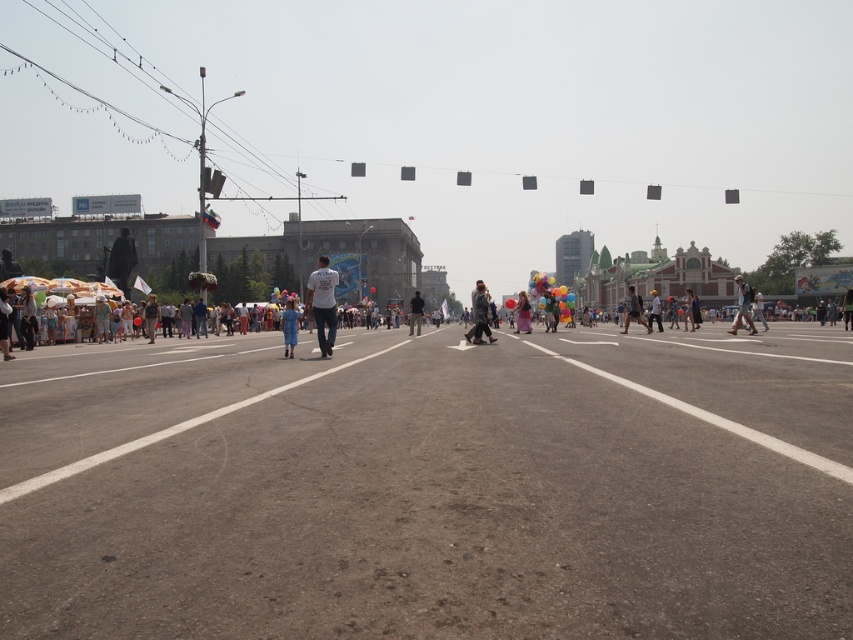
Where is `matte gray coat at center`? This screenshot has height=640, width=853. matte gray coat at center is located at coordinates (479, 316).

Is point (477, 339) closer to camera compared to point (746, 288)?

That is True.

Who is more forward, (467, 339) or (744, 291)?

Point (467, 339) is in front.

This screenshot has height=640, width=853. I want to click on matte gray coat at center, so click(479, 316).

Does dark blue jeans at center appear over pink satin dress at center?

Correct, dark blue jeans at center is located above pink satin dress at center.

Who is positioned more to the right, dark blue jeans at center or pink satin dress at center?

dark blue jeans at center

Who is more distant from viewer, (634, 300) or (523, 320)?

The point (523, 320) is behind.

Identify the location of dark blue jeans at center. (633, 310).

Does multicolored balloons at center have a greater width compared to matte gray coat at center?

Indeed, multicolored balloons at center has a greater width compared to matte gray coat at center.

Between point (561, 316) and point (495, 337), which one is positioned in front?

Point (495, 337)

Where is `multicolored balloons at center`? The width and height of the screenshot is (853, 640). multicolored balloons at center is located at coordinates (550, 294).